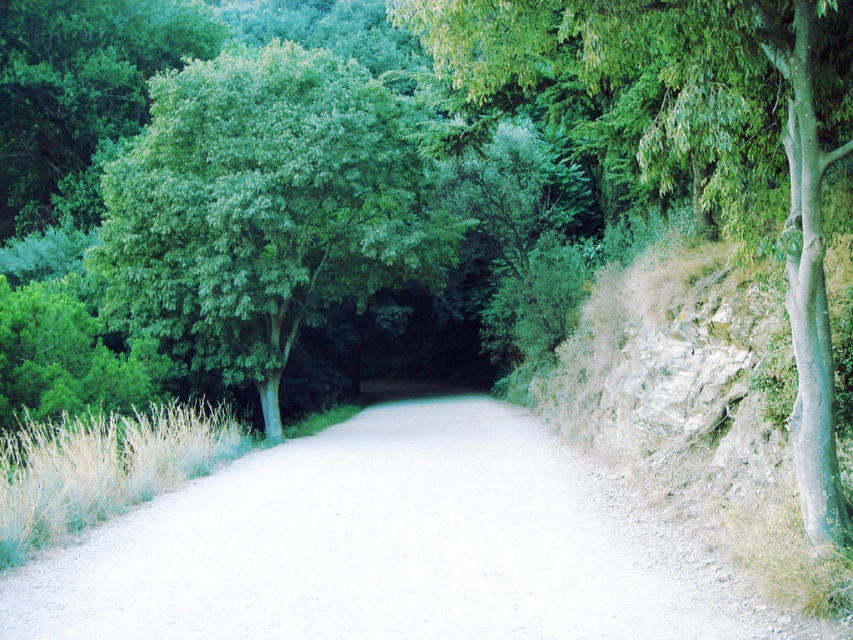
Does gray gravel path at center have a smaller size compared to green leafy tree at right?

No.

The image size is (853, 640). I want to click on gray gravel path at center, so click(384, 547).

Who is taller, gray gravel path at center or green leafy tree at center?

green leafy tree at center is taller.

Who is positioned more to the left, gray gravel path at center or green leafy tree at center?

green leafy tree at center

Who is more distant from viewer, (537, 484) or (177, 330)?

Point (177, 330)

This screenshot has height=640, width=853. Find the location of `gray gravel path at center`. gray gravel path at center is located at coordinates (384, 547).

Does green leafy tree at center have a smaller size compared to green leafy tree at right?

Actually, green leafy tree at center might be larger than green leafy tree at right.

Is the position of green leafy tree at center less distant than that of green leafy tree at right?

That is False.

Which is in front, point (268, 52) or point (703, 17)?

Point (703, 17) is in front.

The width and height of the screenshot is (853, 640). I want to click on green leafy tree at center, so click(263, 209).